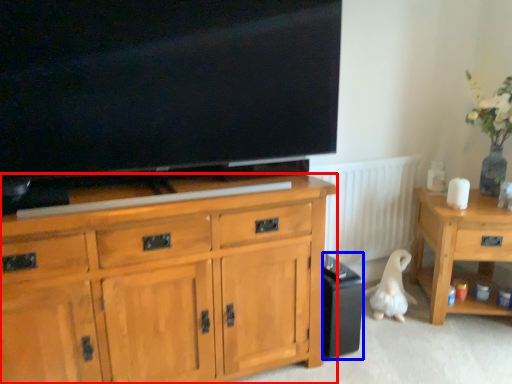
Question: Among these objects, which one is farthest to the camera, cabinetry (highlighted by a red box) or loudspeaker (highlighted by a blue box)?

Choices:
 (A) cabinetry
 (B) loudspeaker

Answer: (B)